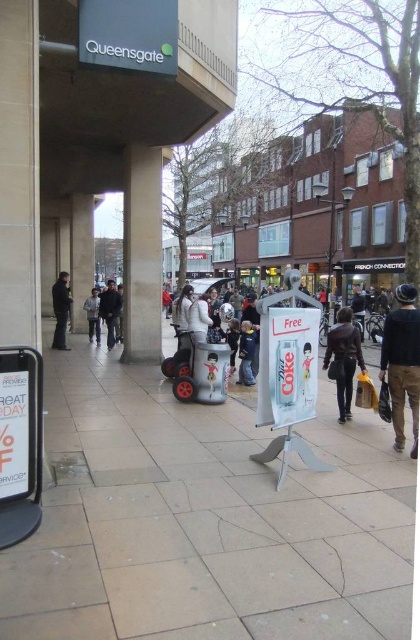
You are a delivery person who needs to load a denim jacket at center onto a matte white scooter at center. Is the scooter under the jacket or the jacket under the scooter?

The matte white scooter at center is positioned under denim jacket at center, so the jacket is above the scooter. To load the jacket onto the scooter, you would need to move it from its current position above the scooter to the scooter itself.

You are a delivery person who needs to pick up a package from the Queensgate shopping area. You see a matte white scooter at center and a denim jacket at center. Which object is closer to your eye level?

The denim jacket at center is taller than the matte white scooter at center, so the denim jacket at center is closer to eye level.

You are a pedestrian walking towards the Diet Coke stand on the right. There are two jackets in your path. Which jacket, the dark gray jacket at left or the denim jacket at center, will you encounter first?

The dark gray jacket at left will be encountered first since it is positioned in front of the denim jacket at center from the pedestrian perspective.